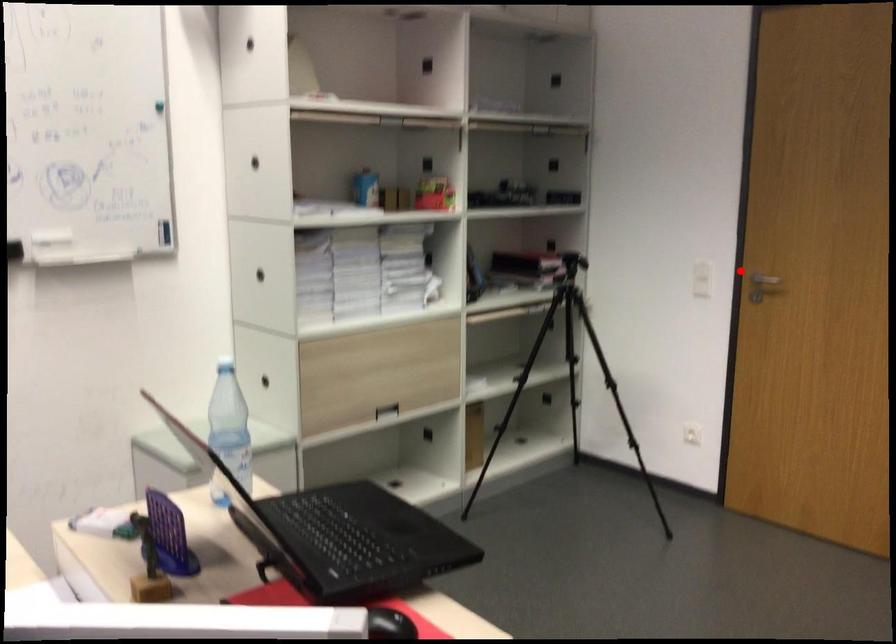
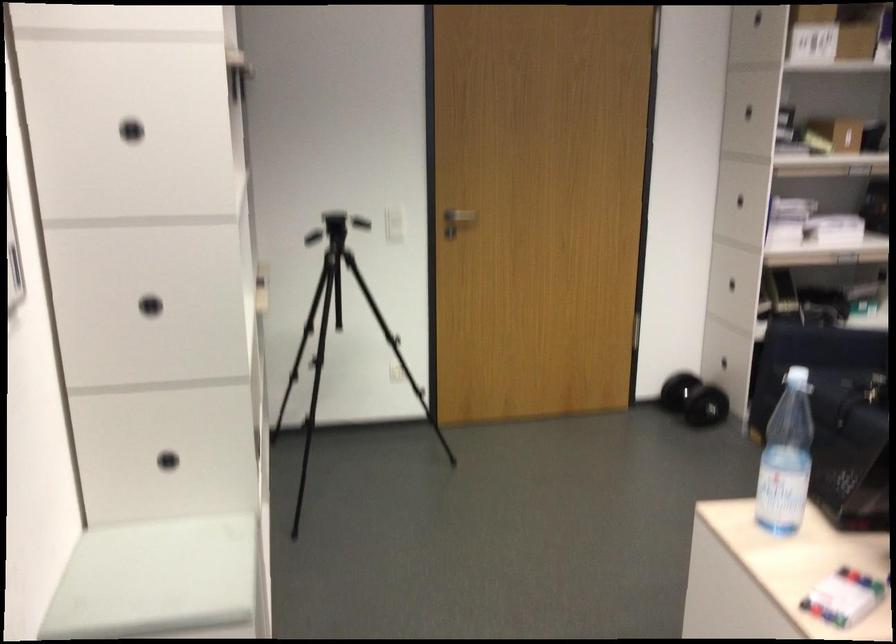
Question: I am providing you with two images of the same scene from different viewpoints. Given a red point in image1, look at the same physical point in image2. Is it:

Choices:
 (A) Closer to the viewpoint
 (B) Farther from the viewpoint

Answer: (B)